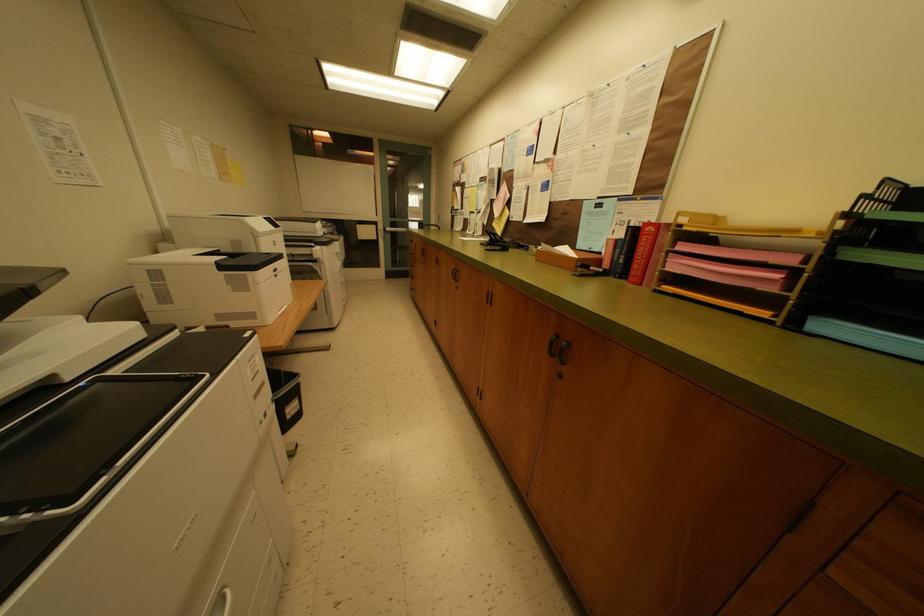
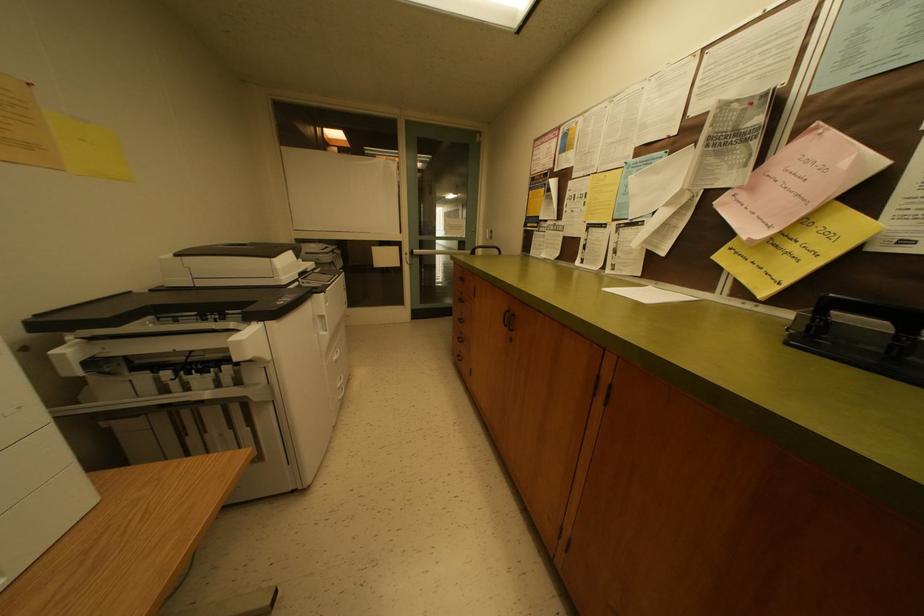
In a continuous first-person perspective shot, in which direction is the camera moving?

The movement direction of the cameraman is left, forward.